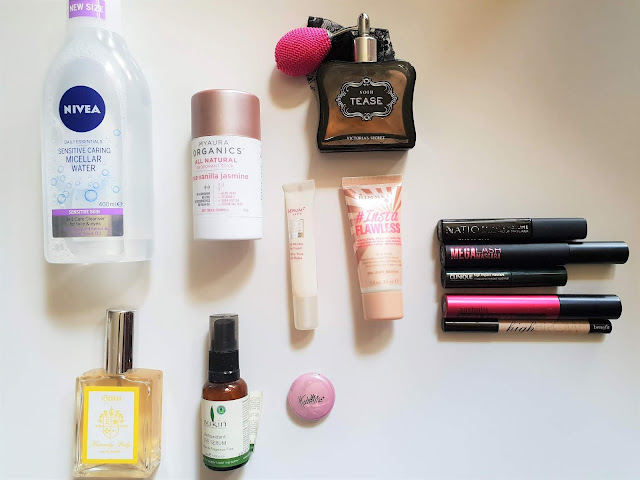
Locate an element on the screen. This screenshot has width=640, height=480. perfume is located at coordinates (390, 62), (387, 117).